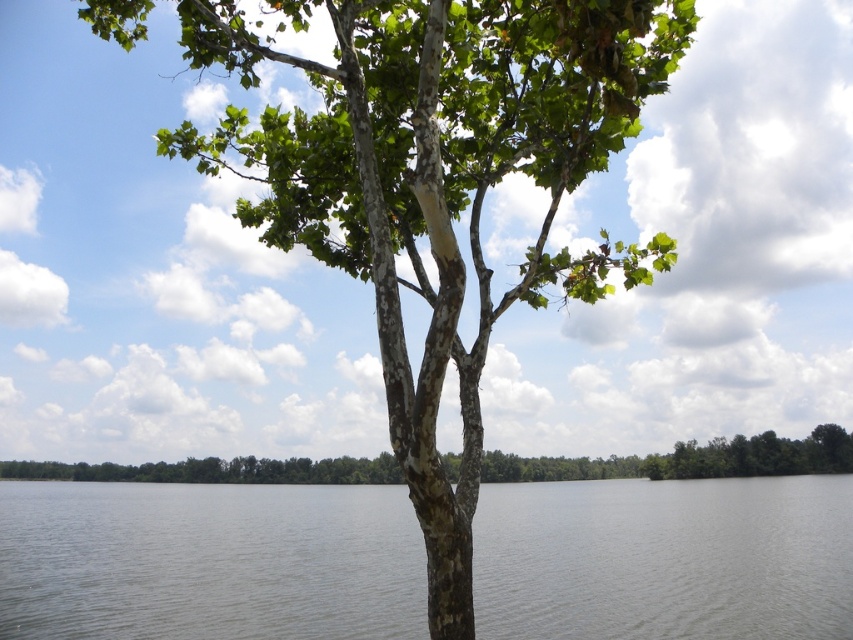
Based on the photo, is gray water at center positioned before smooth bark tree at center?

No, it is not.

Who is lower down, gray water at center or smooth bark tree at center?

gray water at center is below.

Where is `gray water at center`? gray water at center is located at coordinates (209, 561).

Does point (350, 22) come behind point (427, 220)?

Yes, point (350, 22) is behind point (427, 220).

Can you confirm if green bark tree at center is wider than smooth bark tree trunk at center?

No, green bark tree at center is not wider than smooth bark tree trunk at center.

Image resolution: width=853 pixels, height=640 pixels. Describe the element at coordinates (439, 182) in the screenshot. I see `green bark tree at center` at that location.

Find the location of a particular element. green bark tree at center is located at coordinates (439, 182).

Between gray water at center and smooth bark tree trunk at center, which one is positioned lower?

Positioned lower is gray water at center.

Between gray water at center and smooth bark tree trunk at center, which one appears on the left side from the viewer's perspective?

gray water at center

Is point (386, 593) farther from camera compared to point (376, 332)?

That is True.

Identify the location of gray water at center. (209, 561).